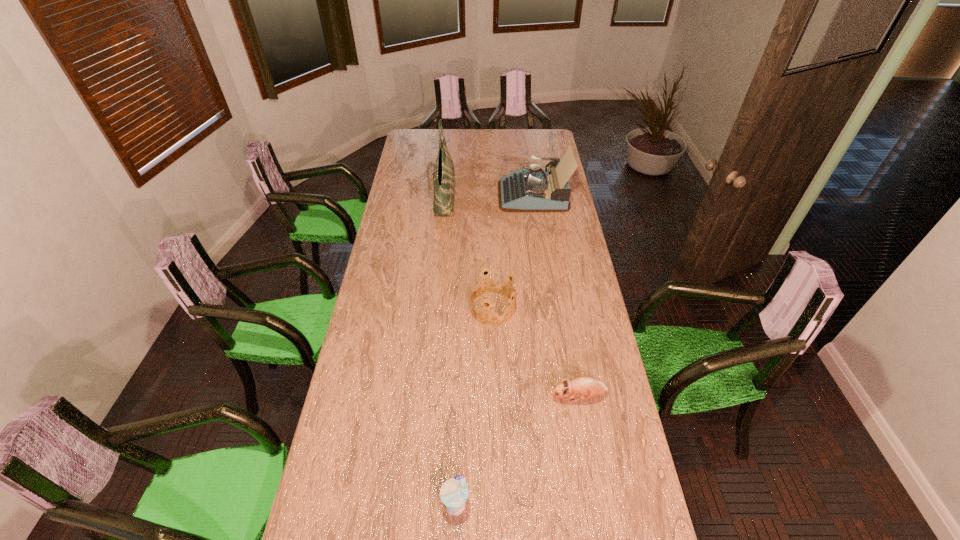
In the image, there is a desktop. Where is `free space at the right edge`? free space at the right edge is located at coordinates (560, 242).

In the image, there is a desktop. Where is `vacant space at the far right corner`? vacant space at the far right corner is located at coordinates (540, 140).

The width and height of the screenshot is (960, 540). In order to click on free point between the fourth shortest object and the nearest object in this screenshot , I will do `click(494, 349)`.

Find the location of a particular element. Image resolution: width=960 pixels, height=540 pixels. empty space that is in between the crown and the typewriter is located at coordinates click(x=513, y=252).

Where is `empty location between the tallest object and the crown`? empty location between the tallest object and the crown is located at coordinates (468, 253).

Locate an element on the screen. The width and height of the screenshot is (960, 540). vacant area that lies between the second tallest object and the fourth farthest object is located at coordinates (556, 295).

Locate an element on the screen. The width and height of the screenshot is (960, 540). free space between the typewriter and the hamster is located at coordinates (556, 295).

What are the coordinates of `free space between the third nearest object and the tallest object` in the screenshot? It's located at (468, 253).

The image size is (960, 540). In order to click on vacant area that lies between the fourth shortest object and the tallest object in this screenshot , I will do `click(489, 196)`.

This screenshot has height=540, width=960. Identify the location of free space between the yogurt and the hamster. point(516,450).